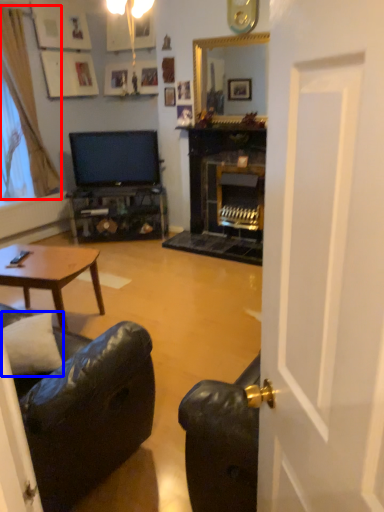
Question: Which object appears farthest to the camera in this image, curtain (highlighted by a red box) or pillow (highlighted by a blue box)?

Choices:
 (A) curtain
 (B) pillow

Answer: (A)